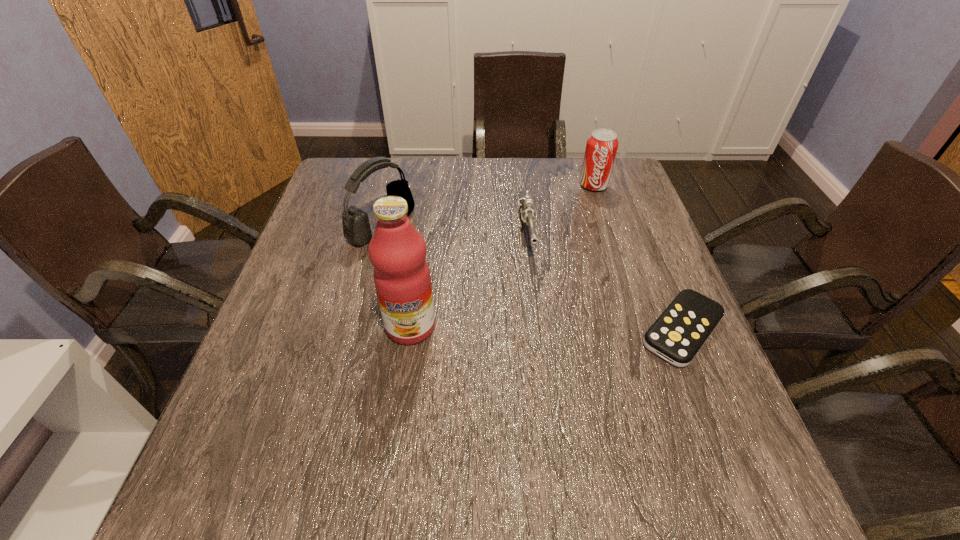
At what (x,y) coordinates should I click in order to perform the action: click on free space on the desktop that is between the tallest object and the shortest object and is positioned on the logo side of the soda can. Please return your answer as a coordinate pair (x, y). Looking at the image, I should click on (577, 329).

Locate an element on the screen. vacant space on the desktop that is between the tallest object and the shortest object and is positioned on the headband of the headset is located at coordinates (568, 328).

Identify the location of vacant space on the desktop that is between the fruit juice and the remote control and is positioned aimed along the barrel of the third object from right to left. (544, 328).